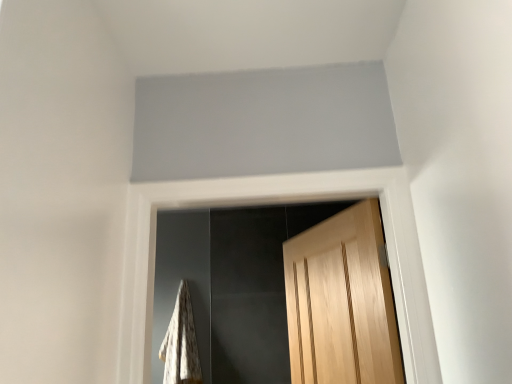
What is the approximate width of white textured blanket at lower left?

white textured blanket at lower left is 6.51 inches wide.

This screenshot has height=384, width=512. What do you see at coordinates (181, 343) in the screenshot?
I see `white textured blanket at lower left` at bounding box center [181, 343].

Where is `white textured blanket at lower left`? The image size is (512, 384). white textured blanket at lower left is located at coordinates (181, 343).

Image resolution: width=512 pixels, height=384 pixels. I want to click on light brown wood door at center, so click(342, 302).

The width and height of the screenshot is (512, 384). What do you see at coordinates (342, 302) in the screenshot?
I see `light brown wood door at center` at bounding box center [342, 302].

Measure the distance between point (387, 377) and camera.

4.69 feet.

You are a GUI agent. You are given a task and a screenshot of the screen. Output one action in this format:
    pyautogui.click(x=<x>, y=<y>)
    Task: Click on the white textured blanket at lower left
    The width and height of the screenshot is (512, 384).
    Given the screenshot: What is the action you would take?
    pyautogui.click(x=181, y=343)

Does light brown wood door at center appear on the left side of white textured blanket at lower left?

Incorrect, light brown wood door at center is not on the left side of white textured blanket at lower left.

Is light brown wood door at center positioned before white textured blanket at lower left?

Yes, light brown wood door at center is closer to the camera.

Which is behind, point (306, 233) or point (195, 339)?

The point (195, 339) is behind.

Looking at this image, from the image's perspective, which object appears higher, light brown wood door at center or white textured blanket at lower left?

light brown wood door at center appears higher in the image.

Based on the photo, from a real-world perspective, who is located lower, light brown wood door at center or white textured blanket at lower left?

white textured blanket at lower left.

Considering the sizes of objects light brown wood door at center and white textured blanket at lower left in the image provided, who is thinner, light brown wood door at center or white textured blanket at lower left?

light brown wood door at center is thinner.

From their relative heights in the image, would you say light brown wood door at center is taller or shorter than white textured blanket at lower left?

Considering their sizes, light brown wood door at center has less height than white textured blanket at lower left.

Between light brown wood door at center and white textured blanket at lower left, which one has larger size?

light brown wood door at center.

In the scene shown: Choose the correct answer: Is light brown wood door at center inside white textured blanket at lower left or outside it?

The correct answer is: outside.

Is light brown wood door at center beside white textured blanket at lower left?

light brown wood door at center is not next to white textured blanket at lower left, and they're not touching.

Is light brown wood door at center looking in the opposite direction of white textured blanket at lower left?

No, light brown wood door at center is not facing the opposite direction of white textured blanket at lower left.

What's the angular difference between light brown wood door at center and white textured blanket at lower left's facing directions?

The angle between the facing direction of light brown wood door at center and the facing direction of white textured blanket at lower left is 67 degrees.

Consider the image. How much distance is there between light brown wood door at center and white textured blanket at lower left?

light brown wood door at center and white textured blanket at lower left are 1.43 meters apart.

Where is `blanket located on the left of light brown wood door at center`? This screenshot has width=512, height=384. blanket located on the left of light brown wood door at center is located at coordinates (181, 343).

Between white textured blanket at lower left and light brown wood door at center, which one appears on the right side from the viewer's perspective?

light brown wood door at center is more to the right.

In the scene shown: Considering the positions of objects white textured blanket at lower left and light brown wood door at center in the image provided, who is in front, white textured blanket at lower left or light brown wood door at center?

light brown wood door at center is closer to the camera.

Is point (176, 333) closer or farther from the camera than point (367, 251)?

Clearly, point (176, 333) is more distant from the camera than point (367, 251).

In the scene shown: From the image's perspective, is white textured blanket at lower left beneath light brown wood door at center?

Correct, white textured blanket at lower left appears lower than light brown wood door at center in the image.

From a real-world perspective, is white textured blanket at lower left positioned above or below light brown wood door at center?

In terms of real-world spatial position, white textured blanket at lower left is below light brown wood door at center.

Does white textured blanket at lower left have a lesser width compared to light brown wood door at center?

No.

Considering the sizes of objects white textured blanket at lower left and light brown wood door at center in the image provided, who is shorter, white textured blanket at lower left or light brown wood door at center?

light brown wood door at center.

Does white textured blanket at lower left have a larger size compared to light brown wood door at center?

Actually, white textured blanket at lower left might be smaller than light brown wood door at center.

Is white textured blanket at lower left inside the boundaries of light brown wood door at center, or outside?

white textured blanket at lower left cannot be found inside light brown wood door at center.

Are white textured blanket at lower left and light brown wood door at center beside each other?

white textured blanket at lower left and light brown wood door at center are not in contact.

Is white textured blanket at lower left turned away from light brown wood door at center?

No.

How many degrees apart are the facing directions of white textured blanket at lower left and light brown wood door at center?

There is a 67-degree angle between the facing directions of white textured blanket at lower left and light brown wood door at center.

This screenshot has height=384, width=512. Identify the location of blanket that is under the light brown wood door at center (from a real-world perspective). (181, 343).

You are a GUI agent. You are given a task and a screenshot of the screen. Output one action in this format:
    pyautogui.click(x=<x>, y=<y>)
    Task: Click on the door on the right of the white textured blanket at lower left
    The height and width of the screenshot is (384, 512).
    Given the screenshot: What is the action you would take?
    pyautogui.click(x=342, y=302)

Locate an element on the screen. This screenshot has width=512, height=384. door above the white textured blanket at lower left (from a real-world perspective) is located at coordinates (342, 302).